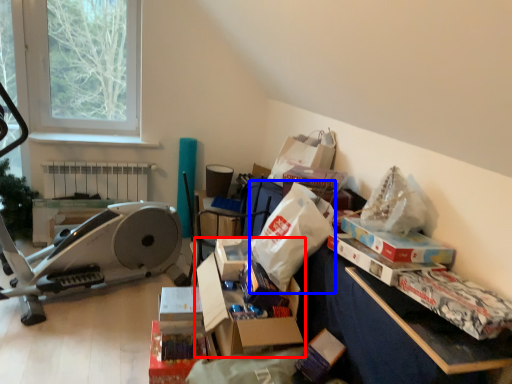
Question: Among these objects, which one is farthest to the camera, storage box (highlighted by a red box) or paper bag (highlighted by a blue box)?

Choices:
 (A) storage box
 (B) paper bag

Answer: (B)